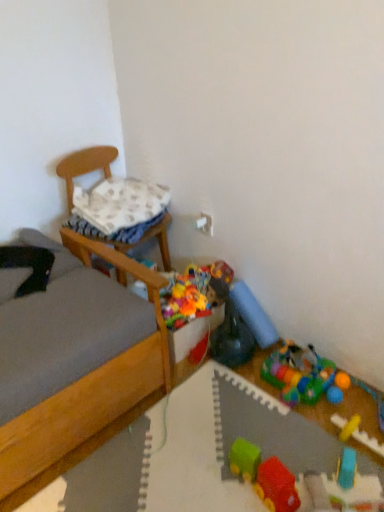
At what (x,y) coordinates should I click in order to perform the action: click on vacant area that lies between rubberized plastic train at center, the 1th toy in the front-to-back sequence, and rubberized plastic play mat at lower right, the third toy viewed from the back. Please return your answer as a coordinate pair (x, y). This screenshot has width=384, height=512. Looking at the image, I should click on (286, 426).